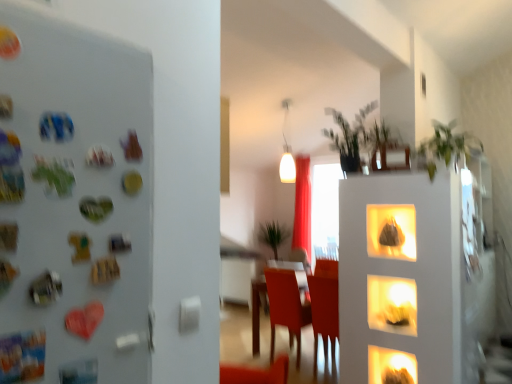
Locate an element on the screen. Image resolution: width=512 pixels, height=384 pixels. blank space above white glossy lamp at upper center (from a real-world perspective) is located at coordinates (287, 99).